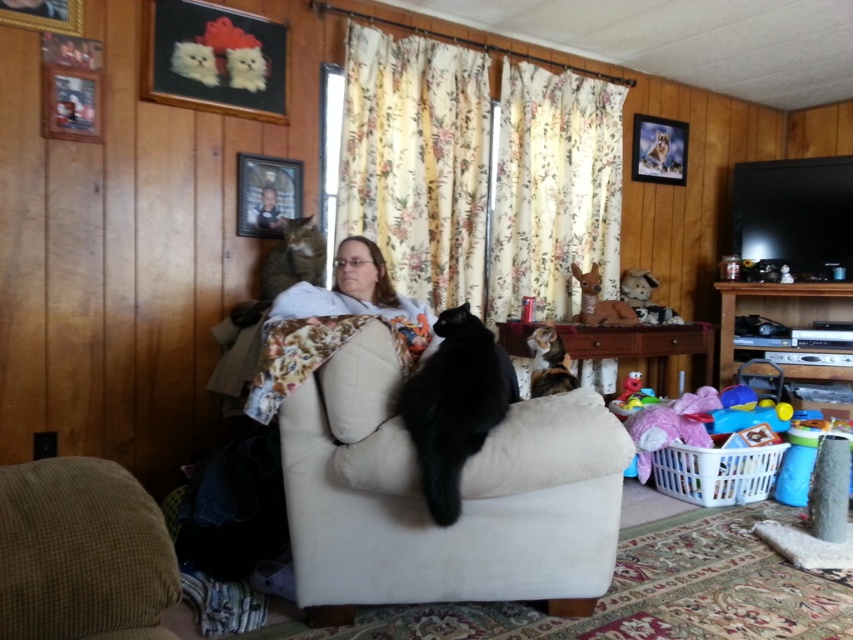
Which is in front, point (492, 388) or point (273, 275)?

Point (492, 388) is more forward.

Is black fur cat at center thinner than tabby fur cat at left?

Yes.

Is point (456, 419) farther from camera compared to point (281, 225)?

No, (456, 419) is in front of (281, 225).

Where is `black fur cat at center`? This screenshot has height=640, width=853. black fur cat at center is located at coordinates (454, 404).

Can you confirm if floral fabric curtain at center is positioned below white plastic laundry basket at lower right?

Incorrect, floral fabric curtain at center is not positioned below white plastic laundry basket at lower right.

From the picture: Does floral fabric curtain at center appear over white plastic laundry basket at lower right?

Correct, floral fabric curtain at center is located above white plastic laundry basket at lower right.

Is point (494, 307) in front of point (753, 460)?

No.

The image size is (853, 640). Find the location of `floral fabric curtain at center`. floral fabric curtain at center is located at coordinates (416, 161).

Is point (473, 333) behind point (277, 227)?

That is False.

Who is more forward, (463,310) or (277,216)?

Point (463,310)

At what (x,y) coordinates should I click in order to perform the action: click on black fur cat at center. Please return your answer as a coordinate pair (x, y). Looking at the image, I should click on (454, 404).